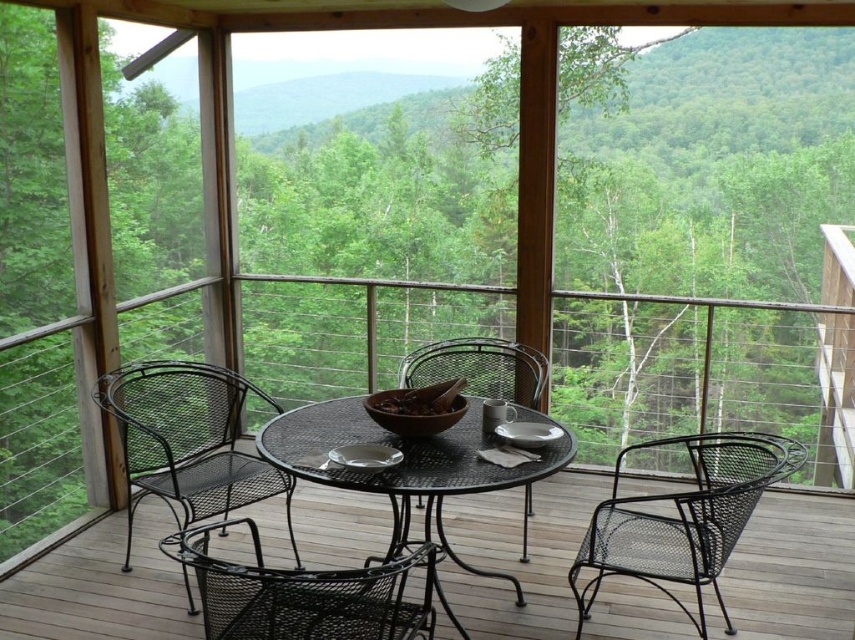
Question: Among these points, which one is farthest from the camera?

Choices:
 (A) (397, 589)
 (B) (470, 435)
 (C) (414, 515)

Answer: (C)

Question: Does black metal table at center appear under black mesh chair at lower center?

Choices:
 (A) yes
 (B) no

Answer: (B)

Question: Can you confirm if black mesh chair at lower center is smaller than black wire mesh chair at center?

Choices:
 (A) yes
 (B) no

Answer: (B)

Question: From the image, what is the correct spatial relationship of black mesh table at center in relation to black metal table at center?

Choices:
 (A) left
 (B) right

Answer: (B)

Question: Which point is closer to the camera?

Choices:
 (A) (405, 472)
 (B) (517, 371)

Answer: (A)

Question: Which point is closer to the camera taking this photo?

Choices:
 (A) (211, 448)
 (B) (405, 461)

Answer: (B)